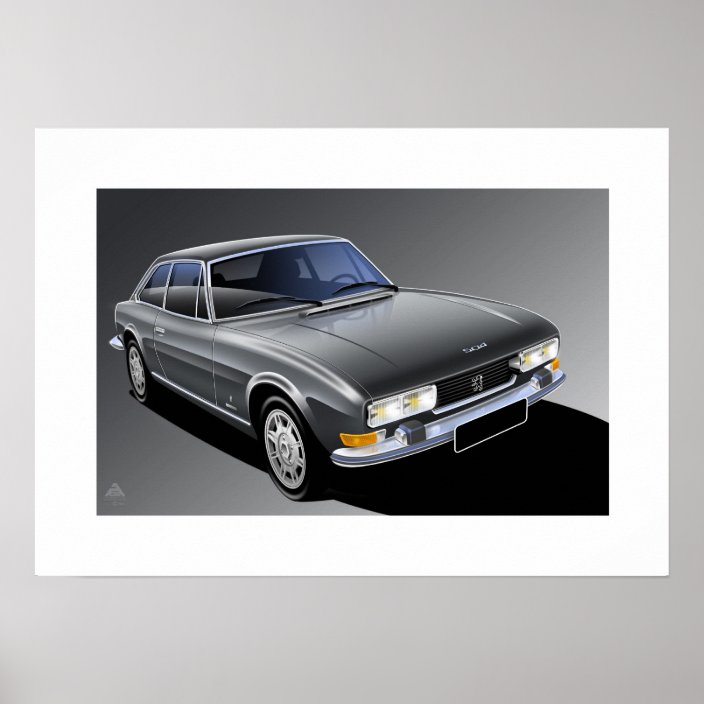
At what (x,y) coordinates should I click in order to perform the action: click on light. Please return your answer as a coordinate pair (x, y). Image resolution: width=704 pixels, height=704 pixels. Looking at the image, I should click on click(x=553, y=363).